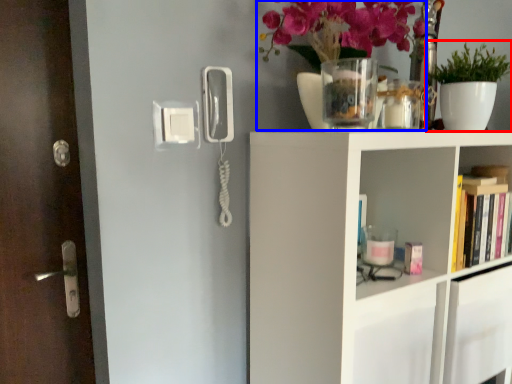
Question: Which object is further to the camera taking this photo, houseplant (highlighted by a red box) or floral arrangement (highlighted by a blue box)?

Choices:
 (A) houseplant
 (B) floral arrangement

Answer: (A)